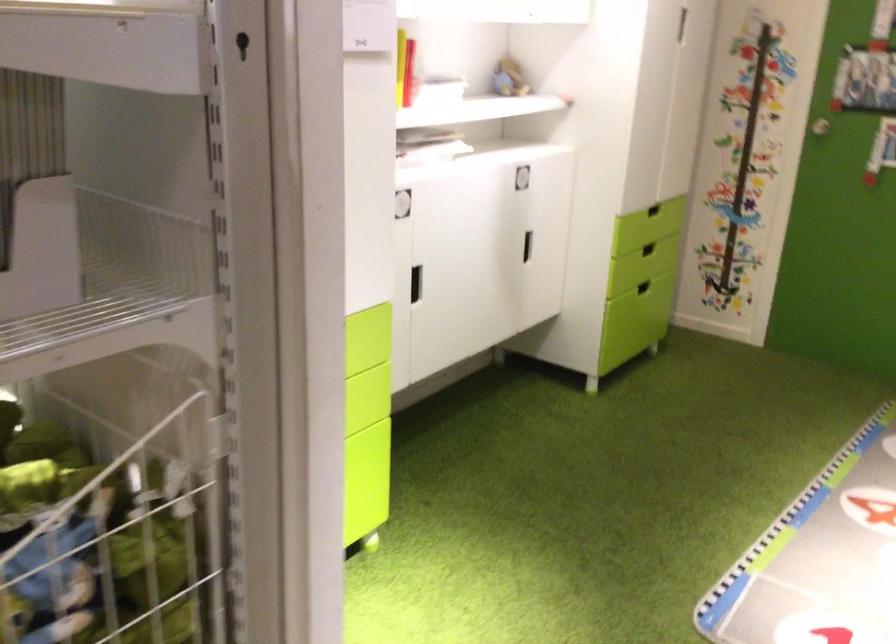
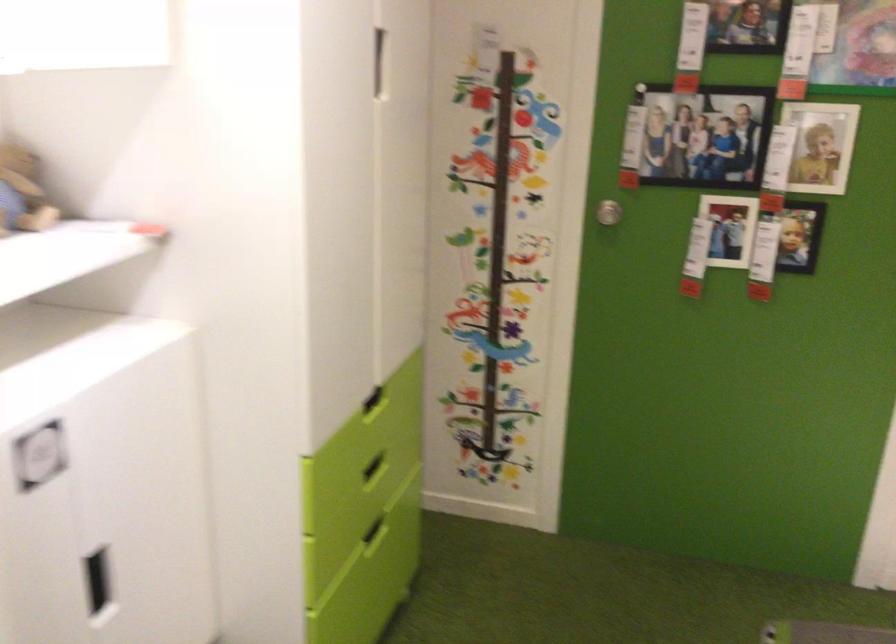
Find the pixel in the second image that matches (x=662, y=222) in the first image.

(373, 401)